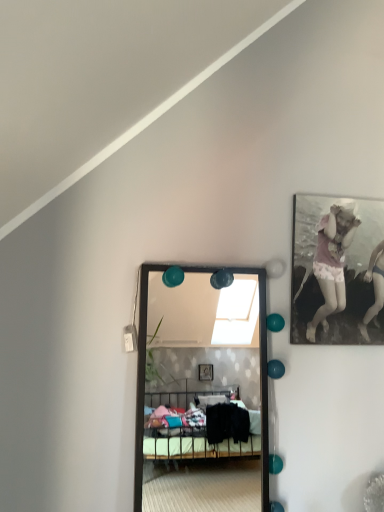
Find the location of a particular element. black glossy mirror at center is located at coordinates (201, 393).

Image resolution: width=384 pixels, height=512 pixels. Describe the element at coordinates (201, 393) in the screenshot. I see `black glossy mirror at center` at that location.

The width and height of the screenshot is (384, 512). Find the location of `black glossy mirror at center`. black glossy mirror at center is located at coordinates (201, 393).